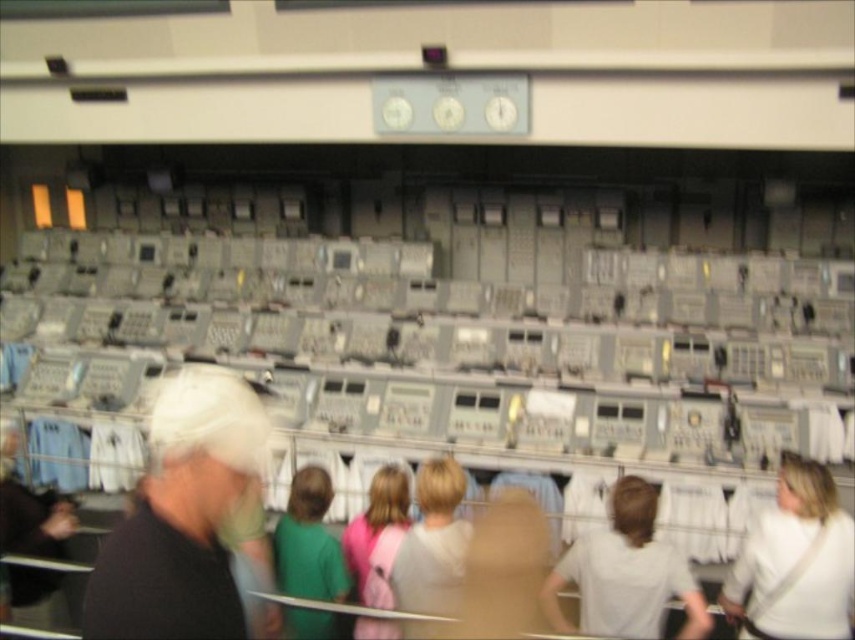
You are a tour guide in the control room and need to point out the white matte cap at upper left and the pink fabric at center to your visitors. Can you fit both items in your field of view without moving your head?

The white matte cap at upper left and pink fabric at center are 79.65 centimeters apart. Since the average human field of view is about 150 degrees, which can cover a much wider distance, you can fit both items in your field of view without moving your head.

You are a tour guide in the control room. You notice two visitors wearing the beige fabric shirt at center and the pink fabric at center. Which visitor is standing closer to the control panels?

The beige fabric shirt at center is located below the pink fabric at center, meaning the visitor wearing the beige fabric shirt at center is standing closer to the control panels since they are positioned lower in the scene.